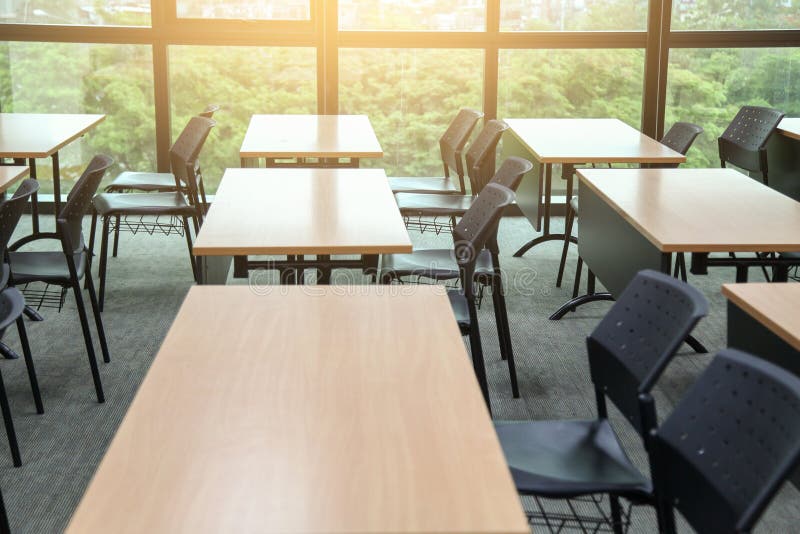
Image resolution: width=800 pixels, height=534 pixels. Find the location of `light wood office tables`. light wood office tables is located at coordinates (30, 116), (10, 178), (296, 140), (282, 231), (306, 368), (692, 218), (594, 136), (758, 299), (793, 130).